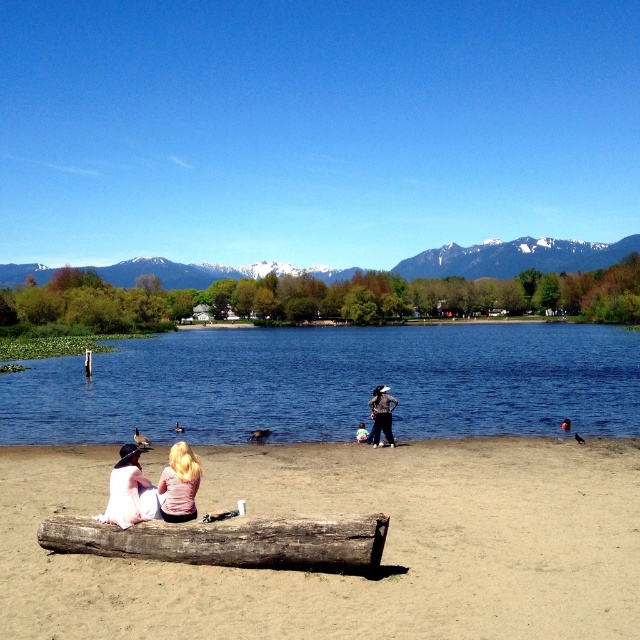
How much distance is there between light pink fabric couple at lower left and matte black jacket at center?

light pink fabric couple at lower left is 38.81 feet away from matte black jacket at center.

Where is `light pink fabric couple at lower left`? The image size is (640, 640). light pink fabric couple at lower left is located at coordinates (150, 488).

Who is higher up, brown sandy beach at lower center or matte black jacket at center?

Positioned higher is matte black jacket at center.

Is point (442, 561) closer to camera compared to point (388, 394)?

Yes, point (442, 561) is in front of point (388, 394).

Between point (157, 452) and point (387, 416), which one is positioned behind?

Positioned behind is point (387, 416).

I want to click on brown sandy beach at lower center, so click(x=349, y=515).

Between brown sandy beach at lower center and light pink fabric couple at lower left, which one appears on the right side from the viewer's perspective?

Positioned to the right is brown sandy beach at lower center.

Is brown sandy beach at lower center taller than light pink fabric couple at lower left?

No.

Does point (460, 605) come closer to viewer compared to point (138, 481)?

Yes, point (460, 605) is closer to viewer.

In order to click on brown sandy beach at lower center in this screenshot , I will do `click(349, 515)`.